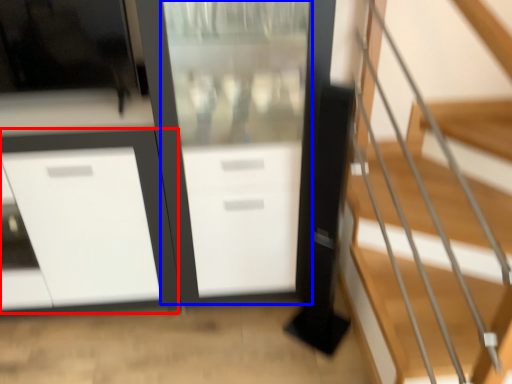
Question: Which object is further to the camera taking this photo, cabinetry (highlighted by a red box) or screen door (highlighted by a blue box)?

Choices:
 (A) cabinetry
 (B) screen door

Answer: (A)